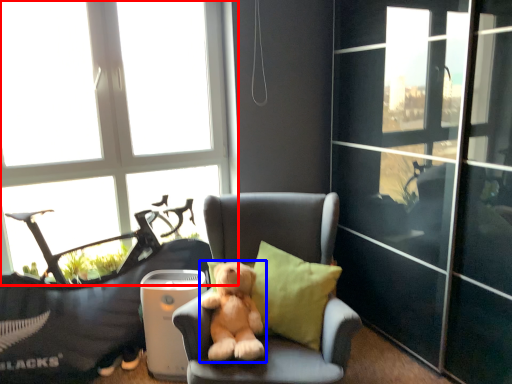
Question: Which of the following is the farthest to the observer, window (highlighted by a red box) or dog (highlighted by a blue box)?

Choices:
 (A) window
 (B) dog

Answer: (A)